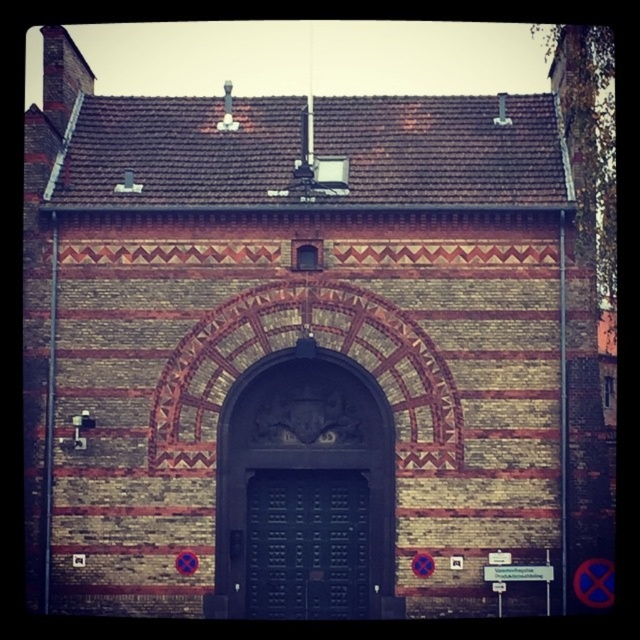
You are an architect reviewing a building design. The scene shows a building with two doors at the center. According to the design specifications, the dark green wooden door at center must be taller than the dark wood door at center. Does the current design meet this requirement?

Yes, the dark green wooden door at center has a greater height compared to the dark wood door at center, so the design meets the requirement.

You are standing in front of the building and want to enter through the door. Which door should you approach first, the dark green wooden door at center or the dark wood door at center?

You should approach the dark green wooden door at center first because it is closer to you than the dark wood door at center.

You are standing in front of the building and want to enter through the dark green wooden door at center. Based on its position, is the door closer to the top or the bottom of the building facade?

The dark green wooden door at center is located at point coordinates approximately 0.477 vertically, which places it closer to the bottom half of the building facade.